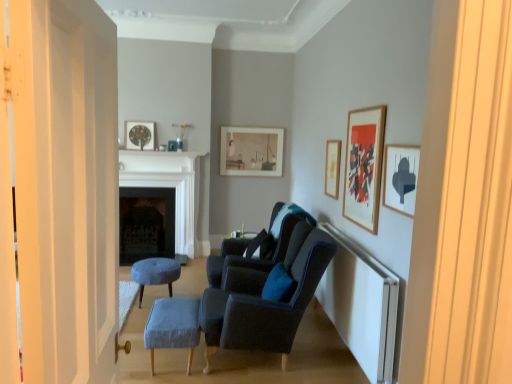
Question: Based on their sizes in the image, would you say suede dark blue armchair at center, arranged as the 2th chair when viewed from the back, is bigger or smaller than matte white picture frame at center, acting as the 4th picture frame starting from the right?

Choices:
 (A) small
 (B) big

Answer: (B)

Question: Looking at their shapes, would you say suede dark blue armchair at center, arranged as the 2th chair when viewed from the back, is wider or thinner than matte white picture frame at center, the fifth picture frame positioned from the front?

Choices:
 (A) thin
 (B) wide

Answer: (B)

Question: Which object is the farthest from the white painted wood door at left?

Choices:
 (A) matte black side table at center
 (B) black stone fireplace at center, which is the second fireplace from front to back
 (C) white marble fireplace at center, which is counted as the 2th fireplace, starting from the back
 (D) velvet blue stool at center, the first stool viewed from the left
 (E) wooden framed artwork at upper right, marked as the second picture frame in a right-to-left arrangement

Answer: (B)

Question: Considering the real-world distances, which object is closest to the velvet blue stool at center, the 2th stool from the front?

Choices:
 (A) blue fabric stool at lower center, which ranks as the second stool in left-to-right order
 (B) matte gold picture frame at upper right, placed as the 3th picture frame when sorted from front to back
 (C) matte black side table at center
 (D) wooden framed artwork at upper right, which is counted as the 4th picture frame, starting from the back
 (E) velvet dark blue armchair at center, the 2th chair viewed from the front

Answer: (C)